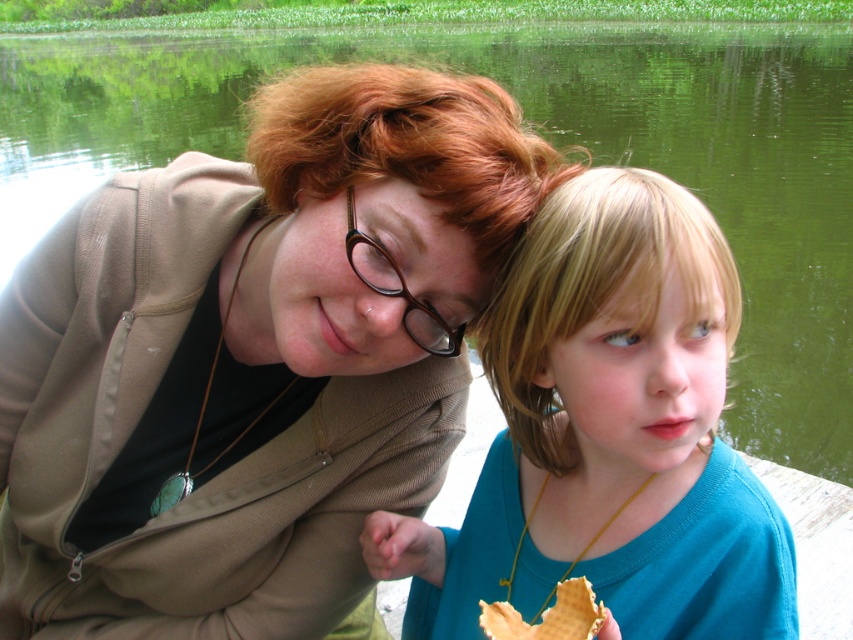
Is blue matte shirt at center further to the viewer compared to brown plastic glasses at center?

No, it is not.

Based on the photo, does blue matte shirt at center have a smaller size compared to brown plastic glasses at center?

No, blue matte shirt at center is not smaller than brown plastic glasses at center.

What do you see at coordinates (607, 435) in the screenshot? This screenshot has width=853, height=640. I see `blue matte shirt at center` at bounding box center [607, 435].

In order to click on blue matte shirt at center in this screenshot , I will do `click(607, 435)`.

Between matte brown jacket at center and waffle-like pastry at lower center, which one is positioned higher?

Positioned higher is matte brown jacket at center.

Does matte brown jacket at center have a lesser height compared to waffle-like pastry at lower center?

No.

Locate an element on the screen. matte brown jacket at center is located at coordinates pyautogui.click(x=253, y=356).

Is matte brown jacket at center below blue matte shirt at center?

No, matte brown jacket at center is not below blue matte shirt at center.

Between point (334, 184) and point (612, 552), which one is positioned behind?

The point (612, 552) is behind.

Is point (328, 278) less distant than point (607, 621)?

No, (328, 278) is behind (607, 621).

Where is `matte brown jacket at center`? matte brown jacket at center is located at coordinates (253, 356).